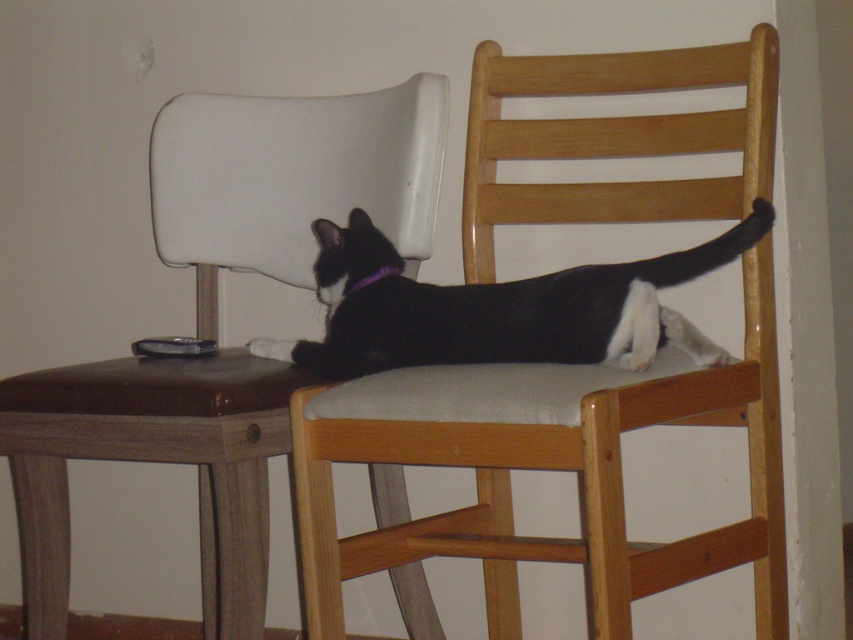
Question: From the image, what is the correct spatial relationship of wooden chair at center in relation to white leather chair at upper left?

Choices:
 (A) above
 (B) below

Answer: (B)

Question: Which of these objects is positioned farthest from the satin black remote at upper left?

Choices:
 (A) purple fabric neckband at center
 (B) wooden chair at center
 (C) white leather chair at upper left

Answer: (B)

Question: Based on their relative distances, which object is nearer to the satin black remote at upper left?

Choices:
 (A) wooden chair at center
 (B) black matte fur cat at center
 (C) white leather chair at upper left
 (D) purple fabric neckband at center

Answer: (C)

Question: Does white leather chair at upper left have a lesser width compared to purple fabric neckband at center?

Choices:
 (A) no
 (B) yes

Answer: (A)

Question: Is wooden chair at center below purple fabric neckband at center?

Choices:
 (A) yes
 (B) no

Answer: (A)

Question: Which point is farther to the camera?

Choices:
 (A) (625, 316)
 (B) (202, 394)
 (C) (206, 348)
 (D) (581, 474)

Answer: (C)